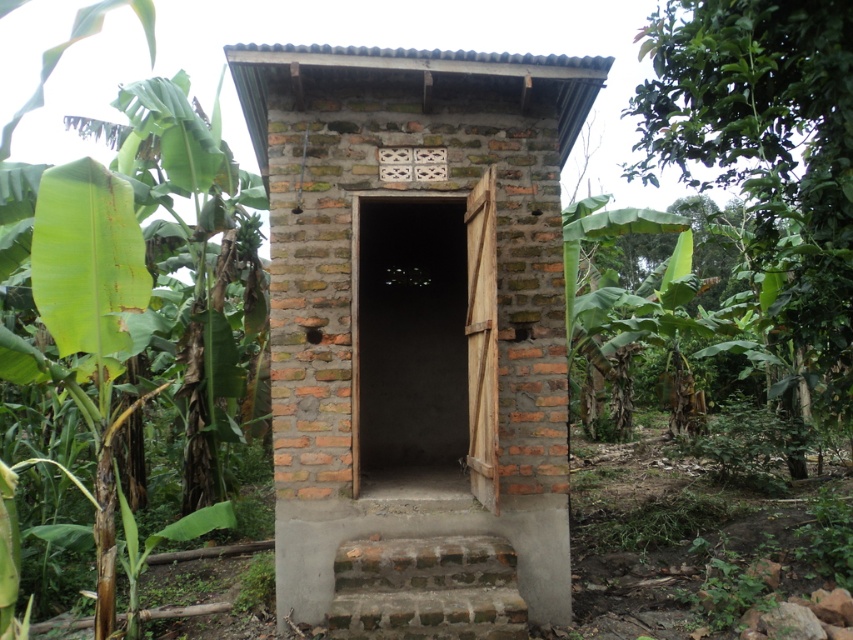
Question: Which is farther from the green leafy banana tree at left?

Choices:
 (A) brick stairs at lower center
 (B) brick/rough wall hut at center

Answer: (A)

Question: Which of the following is the farthest from the observer?

Choices:
 (A) green leafy banana tree at left
 (B) brick stairs at lower center

Answer: (A)

Question: Where is brick/rough wall hut at center located in relation to brick stairs at lower center in the image?

Choices:
 (A) below
 (B) above

Answer: (B)

Question: Among these points, which one is farthest from the camera?

Choices:
 (A) (90, 177)
 (B) (589, 61)

Answer: (B)

Question: Does green leafy banana tree at left appear on the left side of brick stairs at lower center?

Choices:
 (A) no
 (B) yes

Answer: (B)

Question: Can you confirm if brick/rough wall hut at center is positioned below green leafy banana tree at left?

Choices:
 (A) no
 (B) yes

Answer: (B)